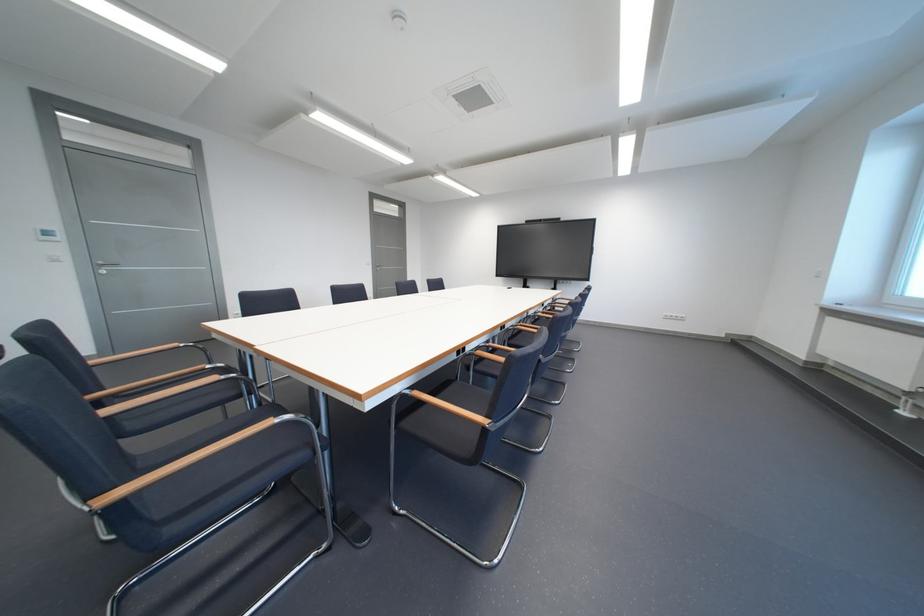
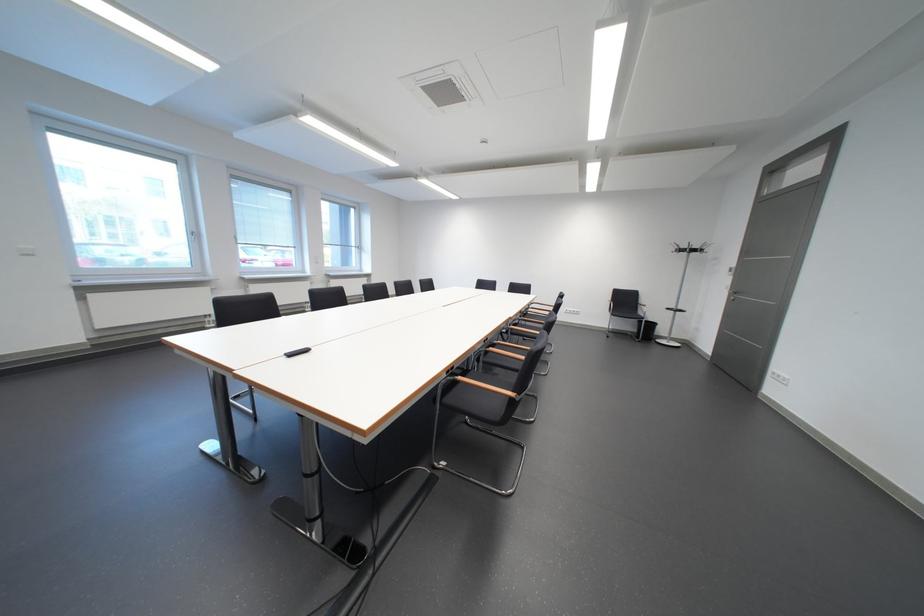
Question: I am providing you with two images of the same scene from different viewpoints. Which of the following objects are not visible in image2?

Choices:
 (A) black trash can
 (B) chair armrest
 (C) red rocker switch
 (D) chair sitting surface

Answer: (D)